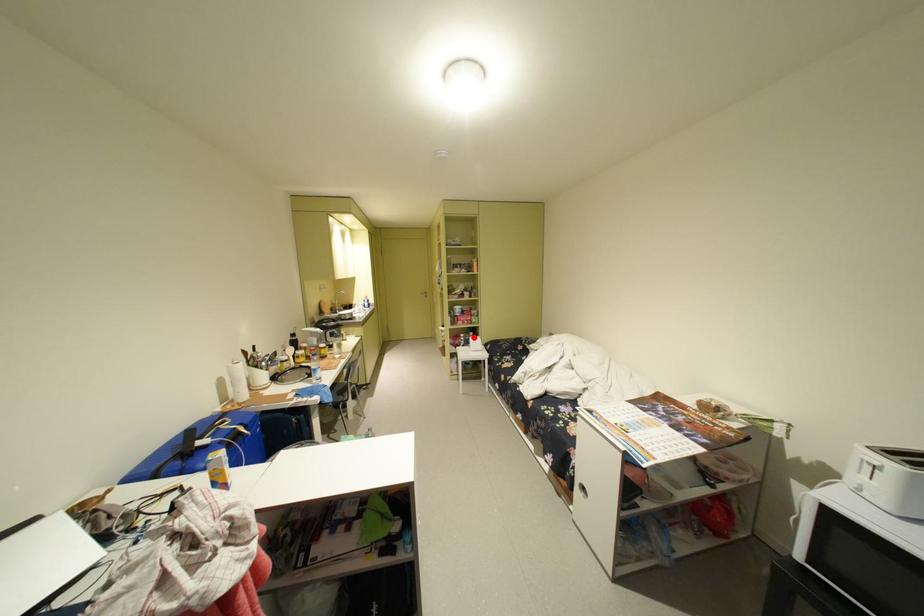
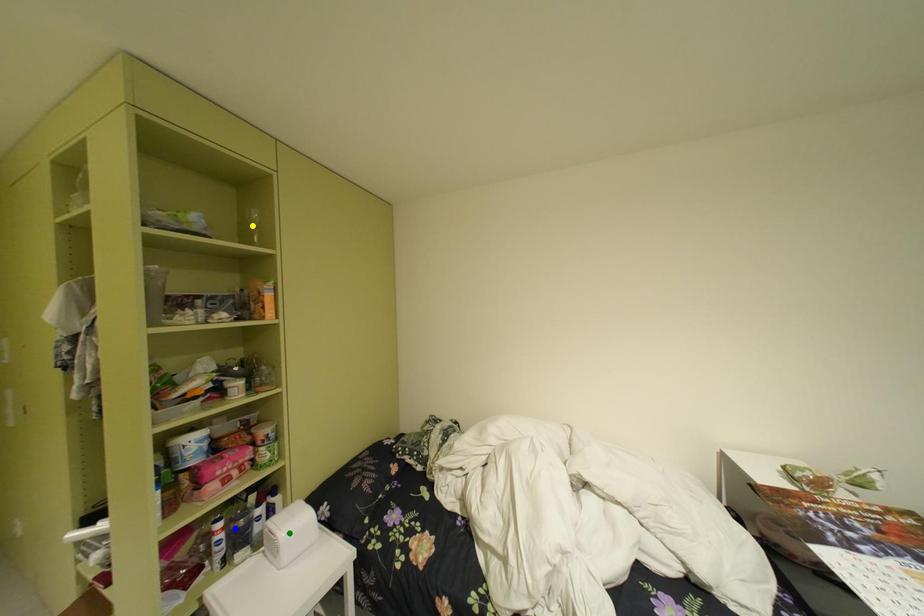
Question: I am providing you with two images of the same scene from different viewpoints. A red point is marked on the first image. You are given multiple points on the second image. Which spot in image 2 lines up with the point in image 1?

Choices:
 (A) yellow point
 (B) blue point
 (C) green point

Answer: (B)